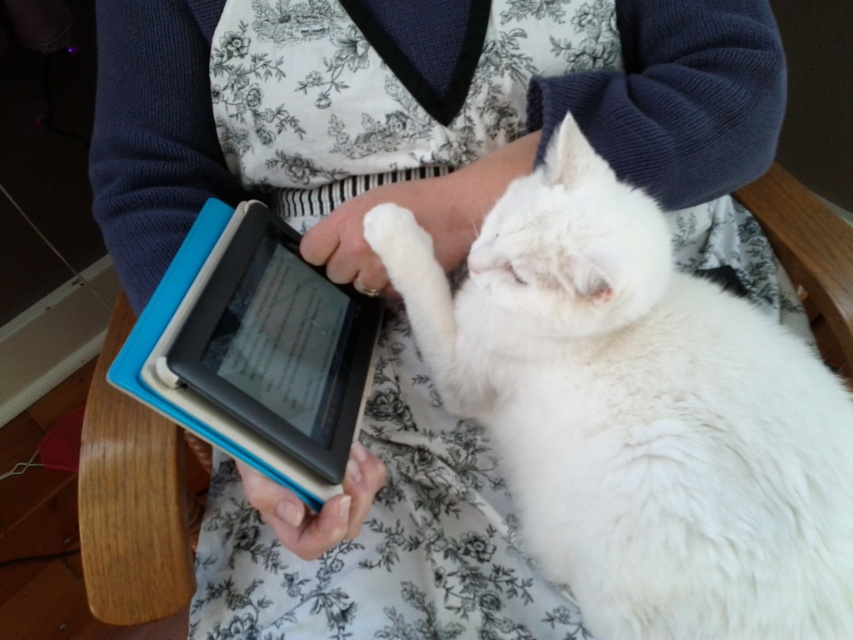
Question: Is white fluffy cat at center wider than matte blue tablet at center?

Choices:
 (A) no
 (B) yes

Answer: (B)

Question: Among these points, which one is farthest from the camera?

Choices:
 (A) (598, 451)
 (B) (260, 422)

Answer: (B)

Question: Does white fluffy cat at center appear on the right side of matte blue tablet at center?

Choices:
 (A) no
 (B) yes

Answer: (B)

Question: Is white fluffy cat at center wider than matte blue tablet at center?

Choices:
 (A) yes
 (B) no

Answer: (A)

Question: Which of the following is the closest to the observer?

Choices:
 (A) white fluffy cat at center
 (B) matte blue tablet at center

Answer: (A)